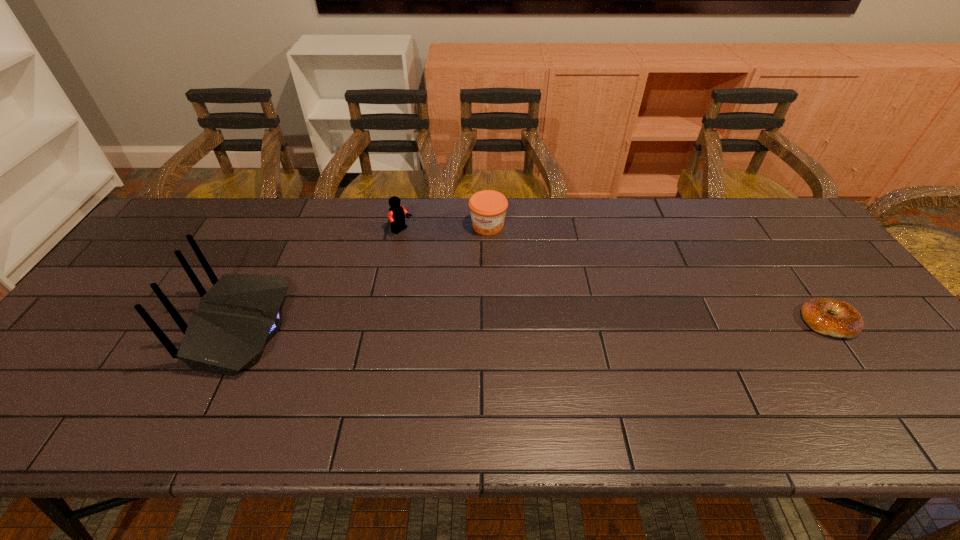
Where is `object at the near edge`? The height and width of the screenshot is (540, 960). object at the near edge is located at coordinates (240, 312).

This screenshot has height=540, width=960. Find the location of `object that is at the right edge`. object that is at the right edge is located at coordinates (847, 323).

This screenshot has height=540, width=960. I want to click on free region at the far edge of the desktop, so click(555, 199).

This screenshot has height=540, width=960. Identify the location of free space at the near edge. (756, 372).

This screenshot has width=960, height=540. In the image, there is a desktop. In order to click on vacant space at the left edge in this screenshot , I will do `click(106, 359)`.

Locate an element on the screen. The height and width of the screenshot is (540, 960). blank space at the far right corner of the desktop is located at coordinates (765, 229).

Identify the location of free space between the third object from left to right and the bagel. (659, 274).

Where is `free space between the router and the shortest object`? free space between the router and the shortest object is located at coordinates (536, 324).

The width and height of the screenshot is (960, 540). I want to click on free spot between the tallest object and the bagel, so click(x=536, y=324).

In order to click on unoccupied area between the Lego and the router in this screenshot , I will do `click(323, 279)`.